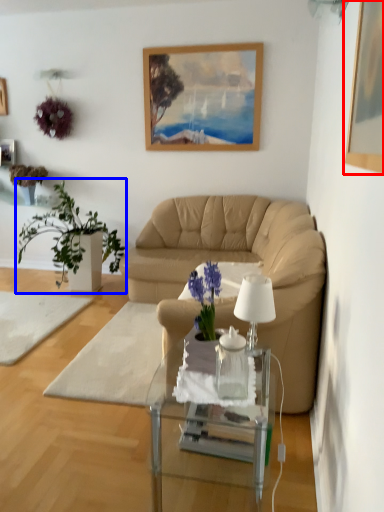
Question: Among these objects, which one is farthest to the camera, picture frame (highlighted by a red box) or houseplant (highlighted by a blue box)?

Choices:
 (A) picture frame
 (B) houseplant

Answer: (B)